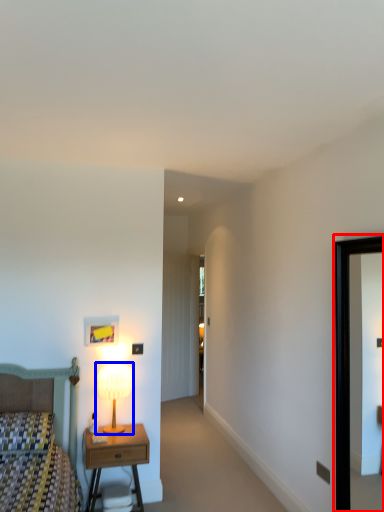
Question: Which object appears closest to the camera in this image, picture frame (highlighted by a red box) or table lamp (highlighted by a blue box)?

Choices:
 (A) picture frame
 (B) table lamp

Answer: (A)